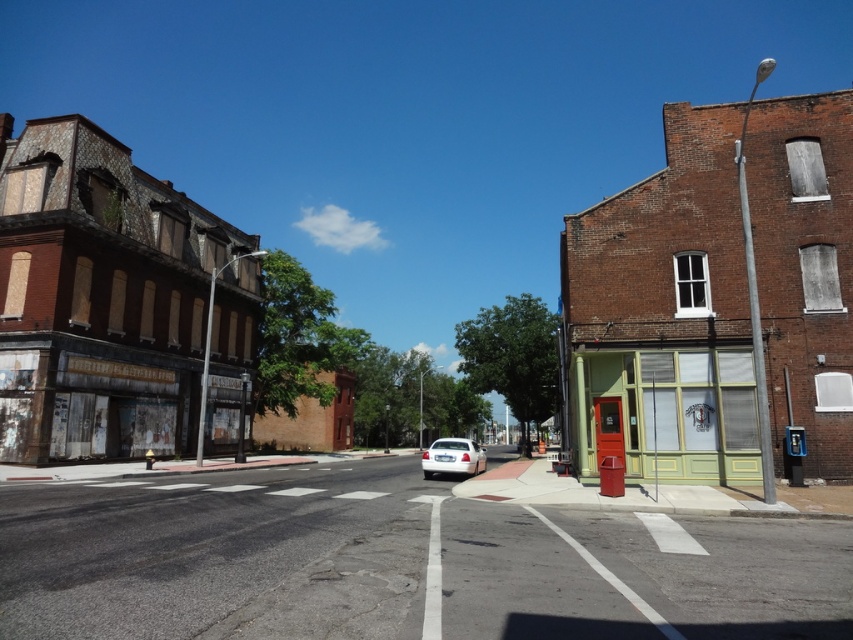
Looking at this image, you are a delivery person trying to park your 2.5 meter wide delivery van. You see the smooth asphalt road at center and the white glossy sedan at center. Can you determine if the road is wide enough to park your van without blocking the sedan?

The smooth asphalt road at center might be wider than white glossy sedan at center, so there is a possibility that the road is wide enough for the delivery van. However, since the exact width difference isn not specified, it is recommended to measure the road width before deciding to park.

You are a delivery drone flying over an urban area and need to land on the smooth asphalt road at center. What are the coordinates where you should aim to land?

The smooth asphalt road at center is located at coordinates point (x=397, y=563), so you should aim to land there.

You are a delivery driver who needs to park your white glossy sedan at center on the smooth asphalt road at center. Can you fit your car completely on the road without overhanging?

The smooth asphalt road at center is shorter than the white glossy sedan at center, so the car cannot be fully parked on the road without overhanging.